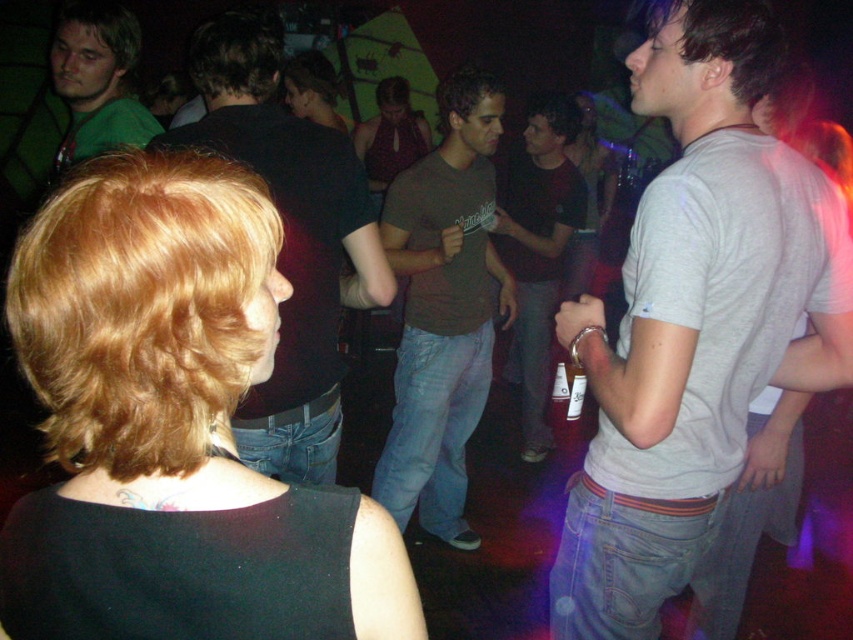
Can you confirm if gray cotton t-shirt at center is positioned below blonde hair at upper left?

Actually, gray cotton t-shirt at center is above blonde hair at upper left.

How much distance is there between gray cotton t-shirt at center and blonde hair at upper left?

gray cotton t-shirt at center is 28.17 inches from blonde hair at upper left.

Is point (750, 330) behind point (254, 243)?

Yes, it is.

Image resolution: width=853 pixels, height=640 pixels. Identify the location of gray cotton t-shirt at center. (695, 320).

Is brown cotton shirt at center thinner than matte black shirt at center?

Incorrect, brown cotton shirt at center's width is not less than matte black shirt at center's.

Is brown cotton shirt at center above matte black shirt at center?

Answer: No, brown cotton shirt at center is not above matte black shirt at center.

Is point (541, 205) positioned behind point (283, 99)?

No, (541, 205) is closer to viewer.

Image resolution: width=853 pixels, height=640 pixels. In order to click on brown cotton shirt at center in this screenshot , I will do `click(538, 248)`.

Based on the photo, can you confirm if blonde hair at upper left is taller than dark brown shirt at center?

No, blonde hair at upper left is not taller than dark brown shirt at center.

In the scene shown: How far apart are blonde hair at upper left and dark brown shirt at center?

They are 1.07 meters apart.

Is point (84, 278) in front of point (346, 234)?

Yes, it is.

Locate an element on the screen. The height and width of the screenshot is (640, 853). blonde hair at upper left is located at coordinates (173, 353).